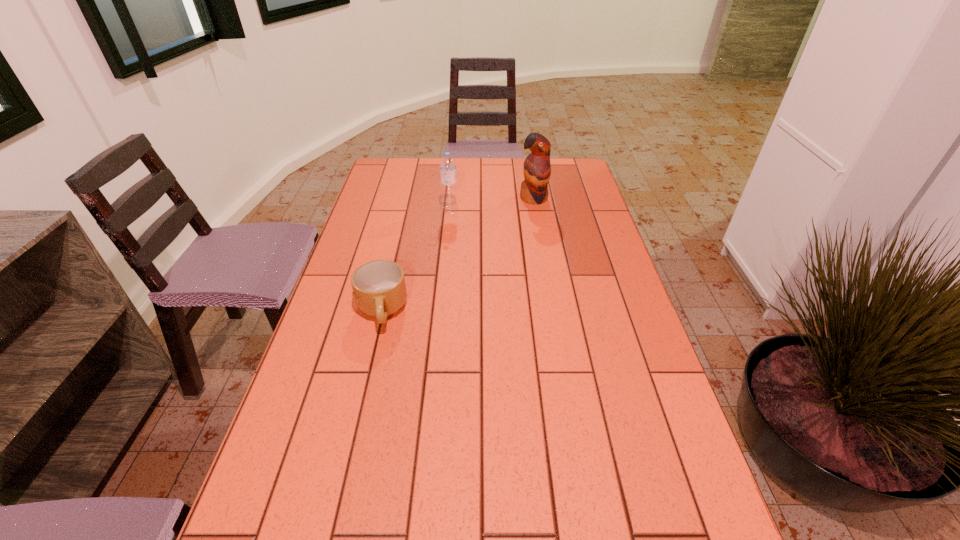
The height and width of the screenshot is (540, 960). Find the location of `the rightmost object`. the rightmost object is located at coordinates (537, 169).

Locate an element on the screen. Image resolution: width=960 pixels, height=540 pixels. parrot is located at coordinates (537, 169).

In order to click on the second object from right to left in this screenshot , I will do `click(448, 173)`.

You are a GUI agent. You are given a task and a screenshot of the screen. Output one action in this format:
    pyautogui.click(x=<x>, y=<y>)
    Task: Click on the water bottle
    The width and height of the screenshot is (960, 540).
    Given the screenshot: What is the action you would take?
    pyautogui.click(x=448, y=173)

Identify the location of mug. (379, 289).

Locate an element on the screen. the leftmost object is located at coordinates (379, 289).

Find the location of a particular element. This screenshot has width=960, height=540. vacant area situated on the face of the parrot is located at coordinates (543, 253).

Find the location of a particular element. The width and height of the screenshot is (960, 540). vacant space located 0.060m on the left of the second object from left to right is located at coordinates (424, 210).

The width and height of the screenshot is (960, 540). Find the location of `vacant space located on the side with the handle of the mug`. vacant space located on the side with the handle of the mug is located at coordinates (372, 356).

Image resolution: width=960 pixels, height=540 pixels. Identify the location of object that is at the left edge. (x=379, y=289).